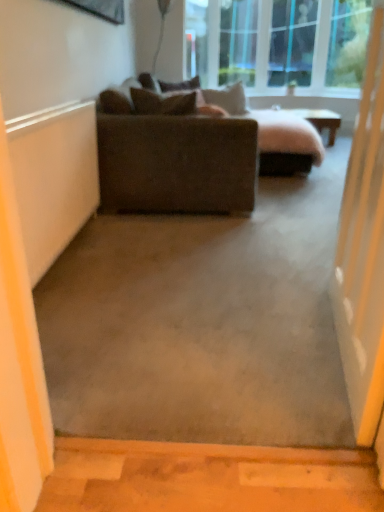
What do you see at coordinates (292, 42) in the screenshot? The height and width of the screenshot is (512, 384). I see `transparent glass door at upper center` at bounding box center [292, 42].

How much space does suede-like brown pillow at upper center, which is the first pillow in back-to-front order, occupy vertically?

suede-like brown pillow at upper center, which is the first pillow in back-to-front order, is 8.40 inches in height.

In order to face wooden table at center, should I rotate leftwards or rightwards?

You should rotate right by 14.310 degrees.

What do you see at coordinates (183, 89) in the screenshot?
I see `suede-like brown pillow at upper center, marked as the 3th pillow in a back-to-front arrangement` at bounding box center [183, 89].

What is the approximate width of suede-like beige pillow at upper center, the 2th pillow in the back-to-front sequence?

suede-like beige pillow at upper center, the 2th pillow in the back-to-front sequence, is 20.44 inches in width.

Looking at this image, measure the distance between dark brown fabric couch at center and camera.

They are 2.61 meters apart.

Describe the element at coordinates (363, 251) in the screenshot. I see `transparent glass screen door at right` at that location.

Find the location of a particular element. transparent glass door at upper center is located at coordinates (292, 42).

Is there a large distance between suede-like beige pillow at upper center, which is the third pillow in front-to-back order, and suede-like brown pillow at upper center, which is the first pillow in back-to-front order?

No, suede-like beige pillow at upper center, which is the third pillow in front-to-back order, is not far from suede-like brown pillow at upper center, which is the first pillow in back-to-front order.

Between suede-like beige pillow at upper center, the 2th pillow in the back-to-front sequence, and suede-like brown pillow at upper center, which ranks as the 4th pillow in front-to-back order, which one appears on the left side from the viewer's perspective?

suede-like brown pillow at upper center, which ranks as the 4th pillow in front-to-back order, is more to the left.

Which object is thinner, suede-like beige pillow at upper center, the 2th pillow in the back-to-front sequence, or suede-like brown pillow at upper center, which is the first pillow in back-to-front order?

With smaller width is suede-like brown pillow at upper center, which is the first pillow in back-to-front order.

Considering the relative positions of suede-like brown pillow at upper center, which is the first pillow in back-to-front order, and suede-like brown pillow at upper center, which is counted as the second pillow, starting from the front, in the image provided, is suede-like brown pillow at upper center, which is the first pillow in back-to-front order, in front of suede-like brown pillow at upper center, which is counted as the second pillow, starting from the front,?

That is False.

Considering the points (177, 90) and (193, 86), which point is in front, point (177, 90) or point (193, 86)?

The point (177, 90) is closer.

Between suede-like brown pillow at upper center, which ranks as the 4th pillow in front-to-back order, and suede-like brown pillow at upper center, marked as the 3th pillow in a back-to-front arrangement, which one has larger width?

Wider between the two is suede-like brown pillow at upper center, marked as the 3th pillow in a back-to-front arrangement.

Would you say suede-like brown pillow at upper center, which is the first pillow in back-to-front order, contains suede-like brown pillow at upper center, marked as the 3th pillow in a back-to-front arrangement?

That's incorrect, suede-like brown pillow at upper center, marked as the 3th pillow in a back-to-front arrangement, is not inside suede-like brown pillow at upper center, which is the first pillow in back-to-front order.

Considering their positions, is suede-like brown pillow at upper center, marked as the 3th pillow in a back-to-front arrangement, located in front of or behind transparent glass screen door at right?

In the image, suede-like brown pillow at upper center, marked as the 3th pillow in a back-to-front arrangement, appears behind transparent glass screen door at right.

From a real-world perspective, relative to transparent glass screen door at right, is suede-like brown pillow at upper center, marked as the 3th pillow in a back-to-front arrangement, vertically above or below?

From a real-world perspective, suede-like brown pillow at upper center, marked as the 3th pillow in a back-to-front arrangement, is physically above transparent glass screen door at right.

Is suede-like brown pillow at upper center, which is counted as the second pillow, starting from the front, not within transparent glass screen door at right?

Yes, suede-like brown pillow at upper center, which is counted as the second pillow, starting from the front, is located beyond the bounds of transparent glass screen door at right.

In the scene shown: From a real-world perspective, is suede-like beige pillow at upper center, the 2th pillow in the back-to-front sequence, located beneath transparent glass screen door at right?

Incorrect, from a real-world perspective, suede-like beige pillow at upper center, the 2th pillow in the back-to-front sequence, is higher than transparent glass screen door at right.

Can you confirm if suede-like beige pillow at upper center, which is the third pillow in front-to-back order, is taller than transparent glass screen door at right?

In fact, suede-like beige pillow at upper center, which is the third pillow in front-to-back order, may be shorter than transparent glass screen door at right.

Is suede-like beige pillow at upper center, which is the third pillow in front-to-back order, not inside transparent glass screen door at right?

Yes, suede-like beige pillow at upper center, which is the third pillow in front-to-back order, is outside of transparent glass screen door at right.

Which is less distant, (168, 82) or (337, 121)?

Clearly, point (168, 82) is more distant from the camera than point (337, 121).

Does suede-like brown pillow at upper center, which is counted as the second pillow, starting from the front, turn towards wooden table at center?

Yes, suede-like brown pillow at upper center, which is counted as the second pillow, starting from the front, is turned towards wooden table at center.

Based on the photo, from a real-world perspective, who is located higher, suede-like brown pillow at upper center, marked as the 3th pillow in a back-to-front arrangement, or wooden table at center?

suede-like brown pillow at upper center, marked as the 3th pillow in a back-to-front arrangement, from a real-world perspective.

Does suede-like brown pillow at upper center, which is counted as the second pillow, starting from the front, have a lesser height compared to wooden table at center?

Correct, suede-like brown pillow at upper center, which is counted as the second pillow, starting from the front, is not as tall as wooden table at center.

Consider the image. From the image's perspective, is transparent glass door at upper center on wooden table at center?

Indeed, from the image's perspective, transparent glass door at upper center is shown above wooden table at center.

Does transparent glass door at upper center have a smaller size compared to wooden table at center?

Indeed, transparent glass door at upper center has a smaller size compared to wooden table at center.

How many degrees apart are the facing directions of transparent glass door at upper center and wooden table at center?

There is a 0.000695-degree angle between the facing directions of transparent glass door at upper center and wooden table at center.

Which object is thinner, dark brown fabric couch at center or transparent glass door at upper center?

transparent glass door at upper center is thinner.

You are a GUI agent. You are given a task and a screenshot of the screen. Output one action in this format:
    pyautogui.click(x=<x>, y=<y>)
    Task: Click on the studio couch in front of the transparent glass door at upper center
    This screenshot has width=384, height=512.
    Given the screenshot: What is the action you would take?
    pyautogui.click(x=193, y=151)

From the image's perspective, is dark brown fabric couch at center under transparent glass door at upper center?

Yes, from the image's perspective, dark brown fabric couch at center is beneath transparent glass door at upper center.

Would you say dark brown fabric couch at center is outside transparent glass door at upper center?

dark brown fabric couch at center lies outside transparent glass door at upper center's area.

Locate an element on the screen. This screenshot has height=512, width=384. pillow above the suede-like beige pillow at upper center, which is the third pillow in front-to-back order (from the image's perspective) is located at coordinates (180, 85).

The width and height of the screenshot is (384, 512). I want to click on the 2nd pillow in front of the suede-like brown pillow at upper center, which is the first pillow in back-to-front order, so click(x=183, y=89).

Which object lies nearer to the anchor point suede-like brown pillow at upper center, marked as the 3th pillow in a back-to-front arrangement, suede-like brown pillow at upper center, which is the first pillow in back-to-front order, or transparent glass screen door at right?

suede-like brown pillow at upper center, which is the first pillow in back-to-front order.

From the image, which object appears to be farther from dark brown fabric couch at center, suede-like brown pillow at upper center, marked as the 4th pillow in a back-to-front arrangement, or wooden table at center?

wooden table at center is positioned further to the anchor dark brown fabric couch at center.

From the image, which object appears to be nearer to suede-like brown pillow at upper center, marked as the 4th pillow in a back-to-front arrangement, suede-like brown pillow at upper center, marked as the 3th pillow in a back-to-front arrangement, or transparent glass screen door at right?

suede-like brown pillow at upper center, marked as the 3th pillow in a back-to-front arrangement, is positioned closer to the anchor suede-like brown pillow at upper center, marked as the 4th pillow in a back-to-front arrangement.

Which object lies further to the anchor point dark brown fabric couch at center, suede-like brown pillow at upper center, which is the first pillow in back-to-front order, or suede-like beige pillow at upper center, which is the third pillow in front-to-back order?

The object further to dark brown fabric couch at center is suede-like beige pillow at upper center, which is the third pillow in front-to-back order.

From the image, which object appears to be farther from wooden table at center, smooth concrete at bottom or suede-like brown pillow at upper center, which is the first pillow in back-to-front order?

smooth concrete at bottom.

Looking at the image, which one is located closer to suede-like beige pillow at upper center, which is the third pillow in front-to-back order, smooth concrete at bottom or transparent glass screen door at right?

transparent glass screen door at right lies closer to suede-like beige pillow at upper center, which is the third pillow in front-to-back order, than the other object.

Which object lies nearer to the anchor point smooth concrete at bottom, suede-like brown pillow at upper center, which is counted as the second pillow, starting from the front, or transparent glass door at upper center?

suede-like brown pillow at upper center, which is counted as the second pillow, starting from the front.

Estimate the real-world distances between objects in this image. Which object is further from suede-like brown pillow at upper center, marked as the 3th pillow in a back-to-front arrangement, suede-like brown pillow at upper center, which ranks as the 4th pillow in front-to-back order, or suede-like beige pillow at upper center, the 2th pillow in the back-to-front sequence?

suede-like beige pillow at upper center, the 2th pillow in the back-to-front sequence, is further to suede-like brown pillow at upper center, marked as the 3th pillow in a back-to-front arrangement.

Where is `studio couch located between transparent glass screen door at right and suede-like beige pillow at upper center, which is the third pillow in front-to-back order, in the depth direction`? Image resolution: width=384 pixels, height=512 pixels. studio couch located between transparent glass screen door at right and suede-like beige pillow at upper center, which is the third pillow in front-to-back order, in the depth direction is located at coordinates (193, 151).

At what (x,y) coordinates should I click in order to perform the action: click on studio couch between transparent glass screen door at right and transparent glass door at upper center from front to back. Please return your answer as a coordinate pair (x, y). The width and height of the screenshot is (384, 512). Looking at the image, I should click on (193, 151).

Image resolution: width=384 pixels, height=512 pixels. In order to click on concrete positioned between transparent glass screen door at right and suede-like brown pillow at upper center, which appears as the first pillow when viewed from the front, from near to far in this screenshot , I will do `click(207, 478)`.

Where is `studio couch located between smooth concrete at bottom and wooden table at center in the depth direction`? Image resolution: width=384 pixels, height=512 pixels. studio couch located between smooth concrete at bottom and wooden table at center in the depth direction is located at coordinates (193, 151).